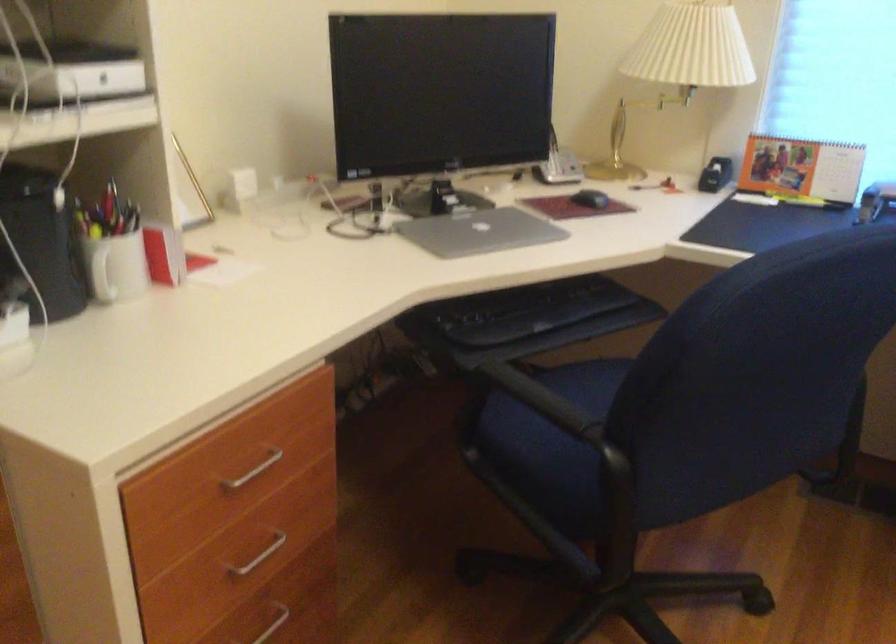
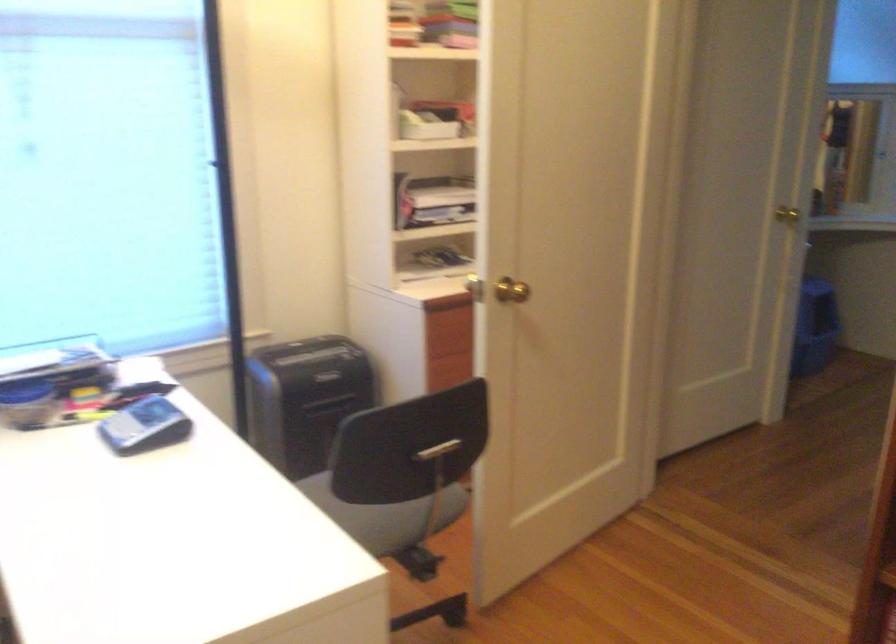
Question: The images are taken continuously from a first-person perspective. In which direction is your viewpoint rotating?

Choices:
 (A) Left
 (B) Right
 (C) Up
 (D) Down

Answer: (B)